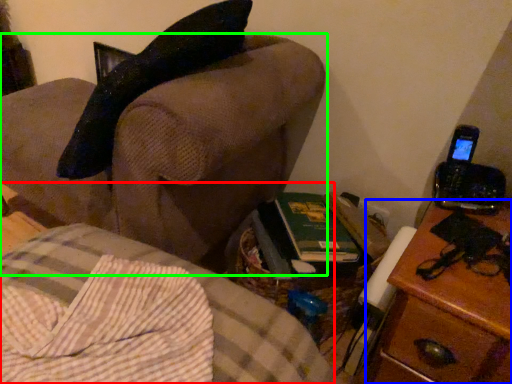
Question: Which object is the closest to the furniture (highlighted by a red box)? Choose among these: nightstand (highlighted by a blue box) or furniture (highlighted by a green box).

Choices:
 (A) nightstand
 (B) furniture

Answer: (B)